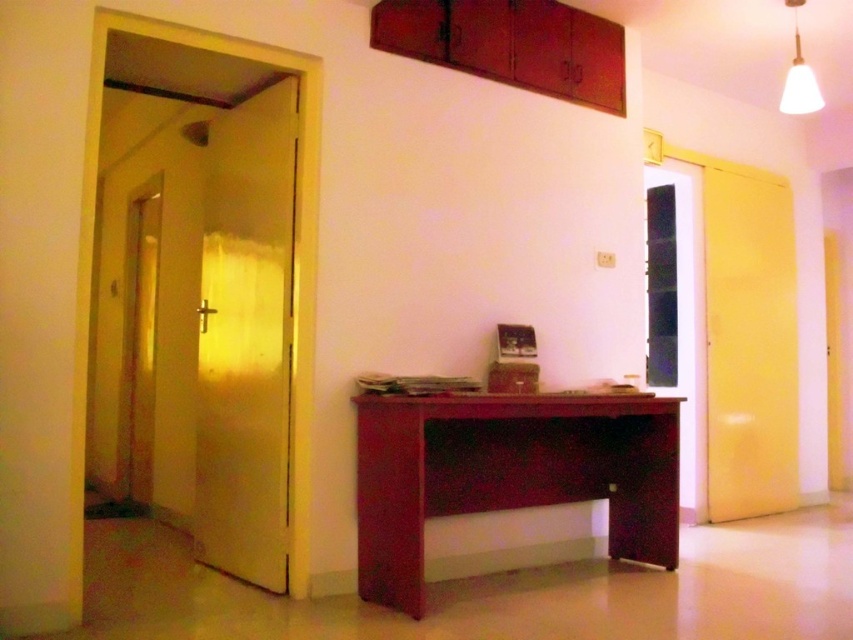
Question: Does satin wood desk at center have a smaller size compared to white matte lampshade at upper right?

Choices:
 (A) yes
 (B) no

Answer: (B)

Question: Among these points, which one is nearest to the camera?

Choices:
 (A) (796, 12)
 (B) (651, 458)

Answer: (B)

Question: Is matte wood cabinet at upper center wider than white matte lampshade at upper right?

Choices:
 (A) no
 (B) yes

Answer: (B)

Question: Can you confirm if satin wood desk at center is wider than matte wood cabinet at upper center?

Choices:
 (A) no
 (B) yes

Answer: (B)

Question: Which is nearer to the white matte lampshade at upper right?

Choices:
 (A) satin wood desk at center
 (B) matte wood cabinet at upper center

Answer: (B)

Question: Based on their relative distances, which object is farther from the matte wood cabinet at upper center?

Choices:
 (A) satin wood desk at center
 (B) white matte lampshade at upper right

Answer: (A)